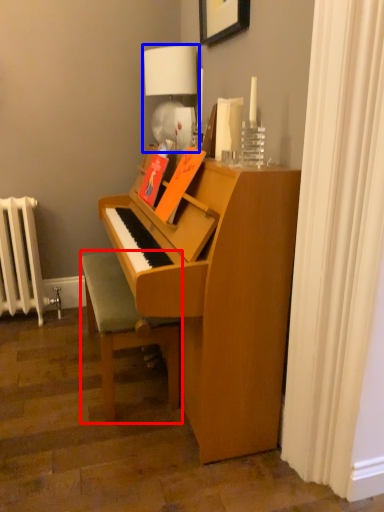
Question: Which of the following is the closest to the observer, furniture (highlighted by a red box) or table lamp (highlighted by a blue box)?

Choices:
 (A) furniture
 (B) table lamp

Answer: (A)